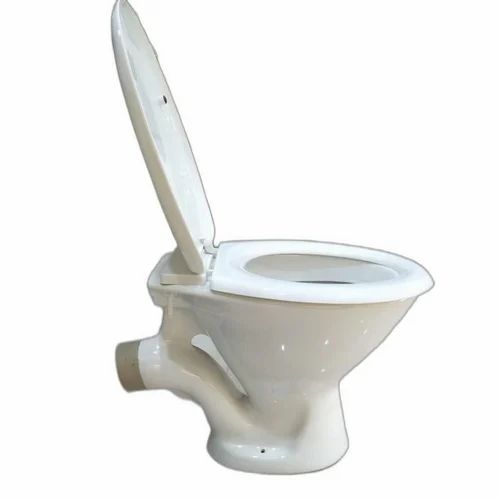
The width and height of the screenshot is (500, 500). I want to click on empty space left of toilet, so click(x=69, y=268).